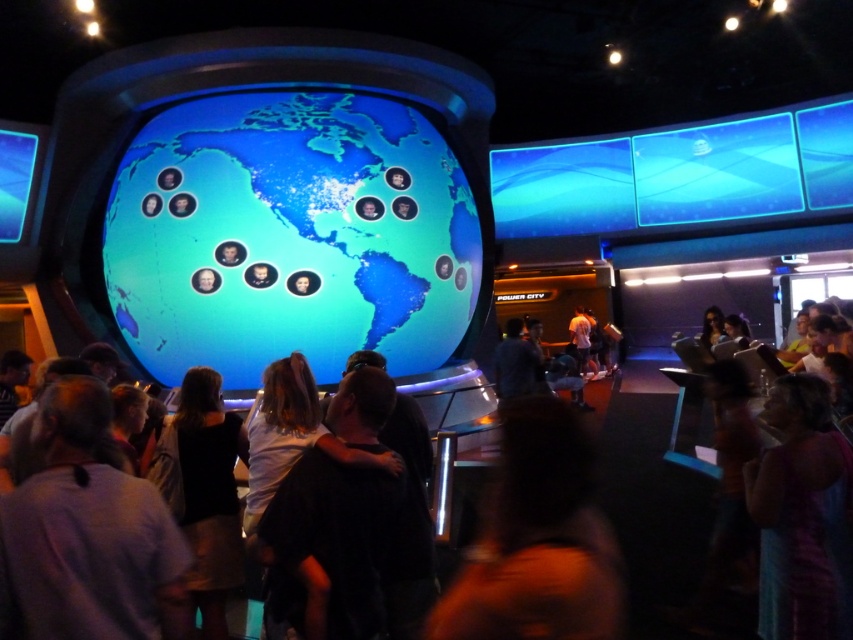
Between dark hair at center and light brown leather jacket at center, which one appears on the left side from the viewer's perspective?

From the viewer's perspective, dark hair at center appears more on the left side.

Can you confirm if dark hair at center is positioned to the left of light brown leather jacket at center?

Yes, dark hair at center is to the left of light brown leather jacket at center.

I want to click on dark hair at center, so click(x=328, y=547).

Image resolution: width=853 pixels, height=640 pixels. Find the location of `dark hair at center`. dark hair at center is located at coordinates (328, 547).

Does point (135, 579) lie in front of point (350, 556)?

Yes, it is in front of point (350, 556).

Which is more to the left, dark purple shirt at center or dark hair at center?

Positioned to the left is dark purple shirt at center.

Is point (3, 540) more distant than point (381, 403)?

No, it is in front of (381, 403).

Find the location of a particular element. This screenshot has height=640, width=853. dark purple shirt at center is located at coordinates (86, 534).

Is blue glossy globe at center positioned in front of light brown leather jacket at center?

Yes, blue glossy globe at center is in front of light brown leather jacket at center.

Who is more distant from viewer, (154, 124) or (585, 336)?

The point (585, 336) is more distant.

Is point (236, 148) closer to viewer compared to point (589, 333)?

Yes, it is.

Locate an element on the screen. This screenshot has width=853, height=640. blue glossy globe at center is located at coordinates (289, 236).